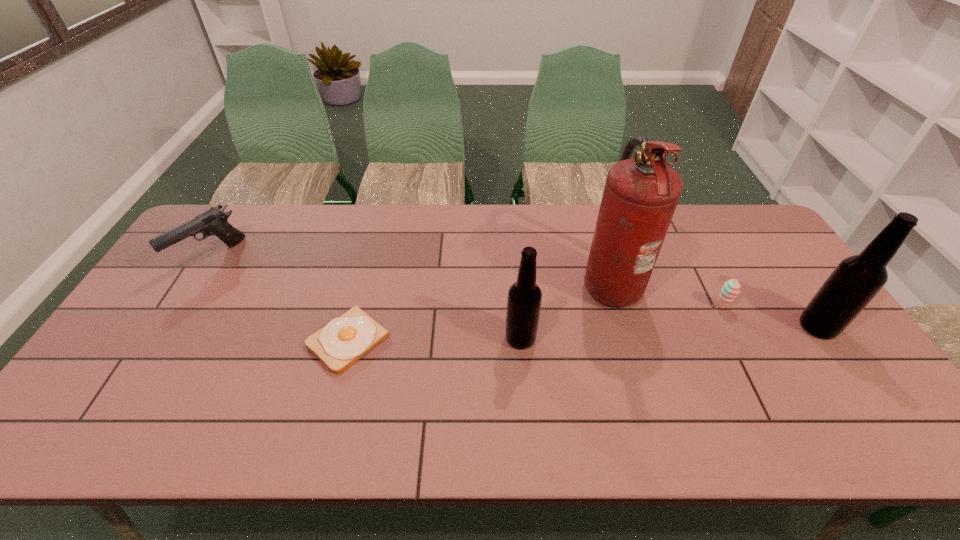
Image resolution: width=960 pixels, height=540 pixels. I want to click on vacant position in the image that satisfies the following two spatial constraints: 1. at the front of the rightmost object where the nozzle is aimed; 2. on the right side of the tallest object, so click(x=623, y=327).

Where is `free region that satisfies the following two spatial constraints: 1. on the back side of the fifth object from right to left; 2. on the left side of the rightmost object`? The height and width of the screenshot is (540, 960). free region that satisfies the following two spatial constraints: 1. on the back side of the fifth object from right to left; 2. on the left side of the rightmost object is located at coordinates (351, 327).

At what (x,y) coordinates should I click in order to perform the action: click on free location that satisfies the following two spatial constraints: 1. at the muzzle of the shortest object; 2. on the left side of the gun. Please return your answer as a coordinate pair (x, y). Looking at the image, I should click on (158, 340).

Identify the location of blank area in the image that satisfies the following two spatial constraints: 1. on the back side of the toast; 2. on the left side of the rightmost object. 351,327.

Identify the location of vacant space that satisfies the following two spatial constraints: 1. on the front side of the rightmost object; 2. on the left side of the fifth tallest object. (732, 327).